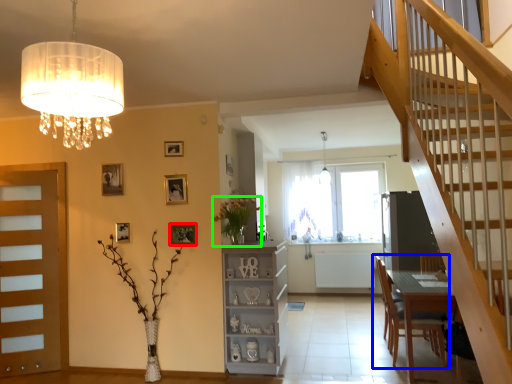
Question: Which is farther away from picture frame (highlighted by a red box)? chair (highlighted by a blue box) or floral arrangement (highlighted by a green box)?

Choices:
 (A) chair
 (B) floral arrangement

Answer: (A)